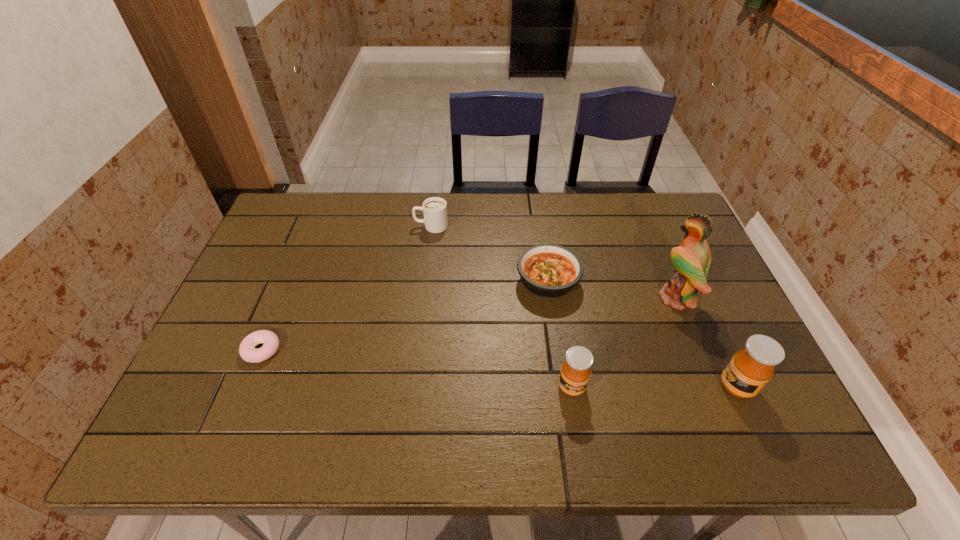
Locate an element on the screen. vacant area that satisfies the following two spatial constraints: 1. on the side with the handle of the farthest object; 2. on the front side of the doughnut is located at coordinates (416, 350).

The height and width of the screenshot is (540, 960). In order to click on blank area in the image that satisfies the following two spatial constraints: 1. on the back side of the second shortest object; 2. on the side with the handle of the farthest object in this screenshot , I will do `click(540, 226)`.